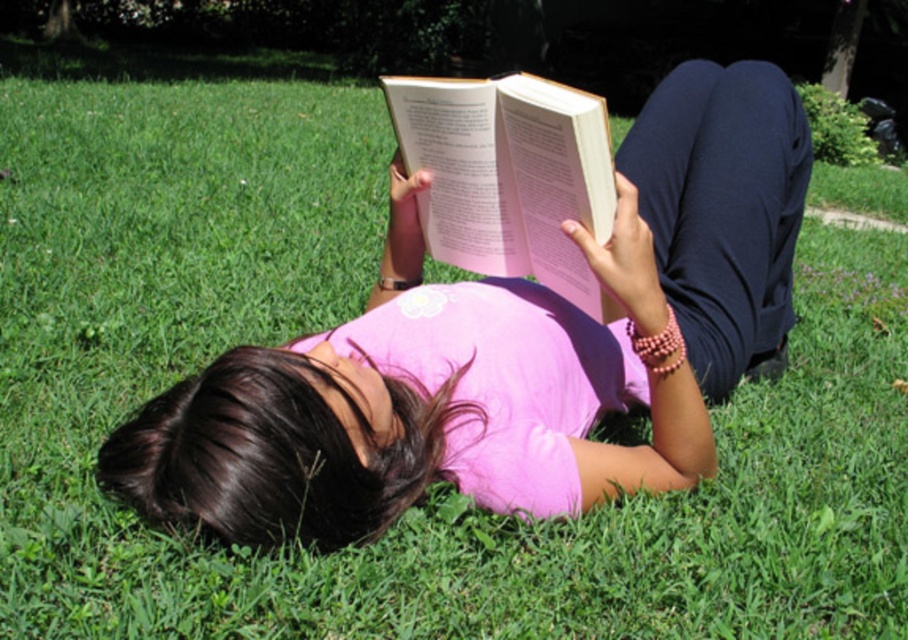
Who is taller, pink matte shirt at center or hardcover book at center?

pink matte shirt at center

Is point (520, 460) behind point (517, 173)?

No, (520, 460) is in front of (517, 173).

Which is in front, point (435, 369) or point (514, 109)?

Point (514, 109)

Find the location of `pink matte shirt at center`. pink matte shirt at center is located at coordinates (505, 349).